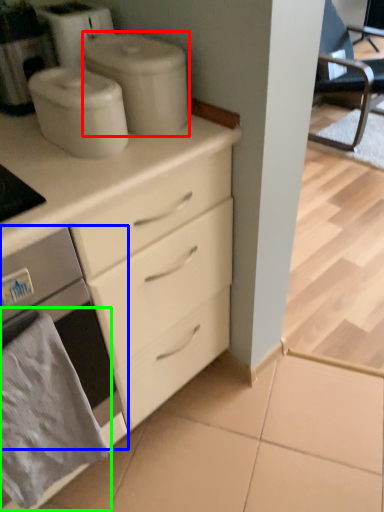
Question: Which object is positioned farthest from appliance (highlighted by a red box)? Select from home appliance (highlighted by a blue box) and material (highlighted by a green box).

Choices:
 (A) home appliance
 (B) material

Answer: (B)